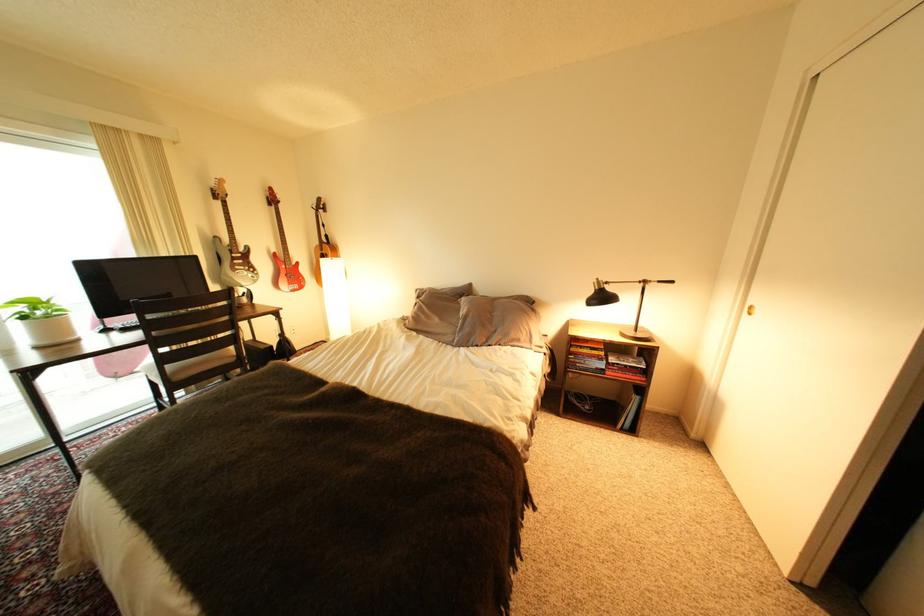
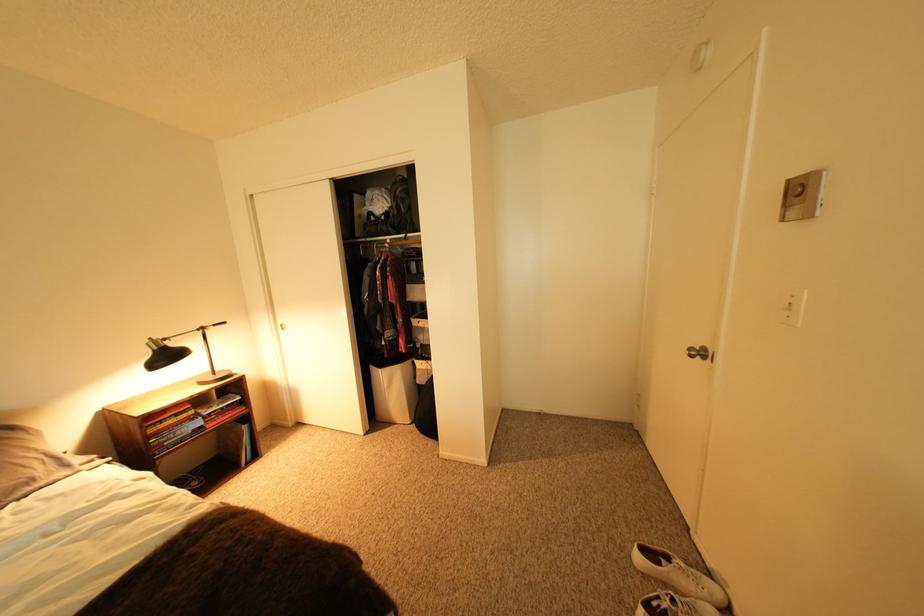
Question: The camera is either moving clockwise (left) or counter-clockwise (right) around the object. The first image is from the beginning of the video and the second image is from the end. Is the camera moving left or right when shooting the video?

Choices:
 (A) Left
 (B) Right

Answer: (A)